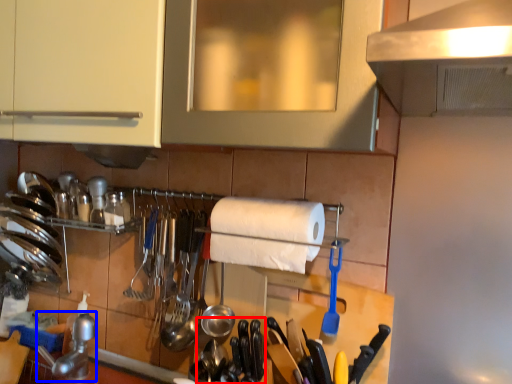
Question: Which object is closer to the camera taking this photo, silverware (highlighted by a red box) or stainless steel (highlighted by a blue box)?

Choices:
 (A) silverware
 (B) stainless steel

Answer: (A)